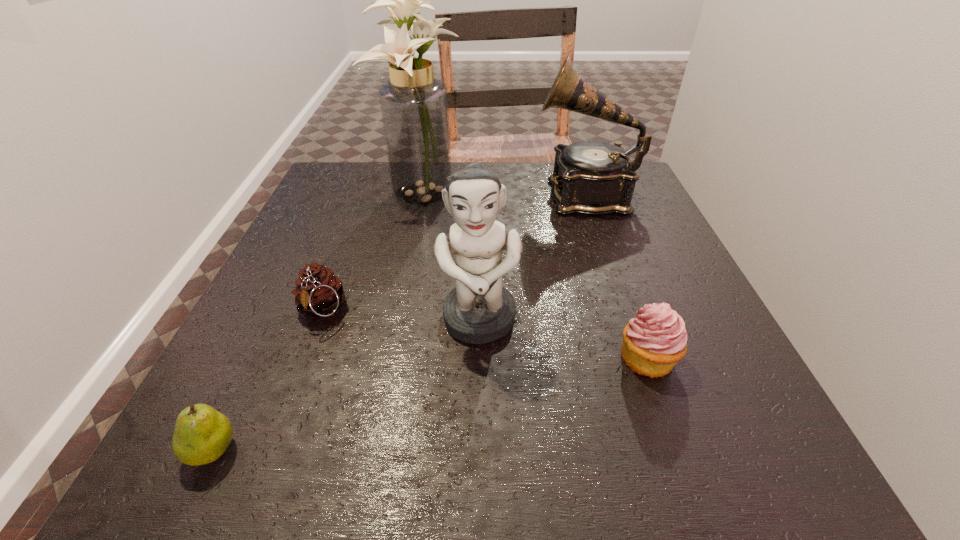
Identify the location of vacant space that satisfies the following two spatial constraints: 1. on the front-facing side of the cupcake; 2. on the left side of the figurine. (479, 359).